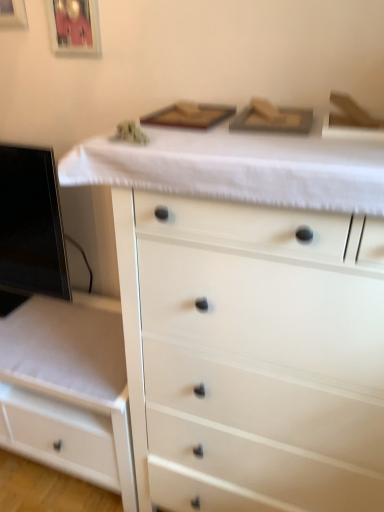
Locate an element on the screen. unoccupied area in front of black glossy computer monitor at left is located at coordinates (34, 342).